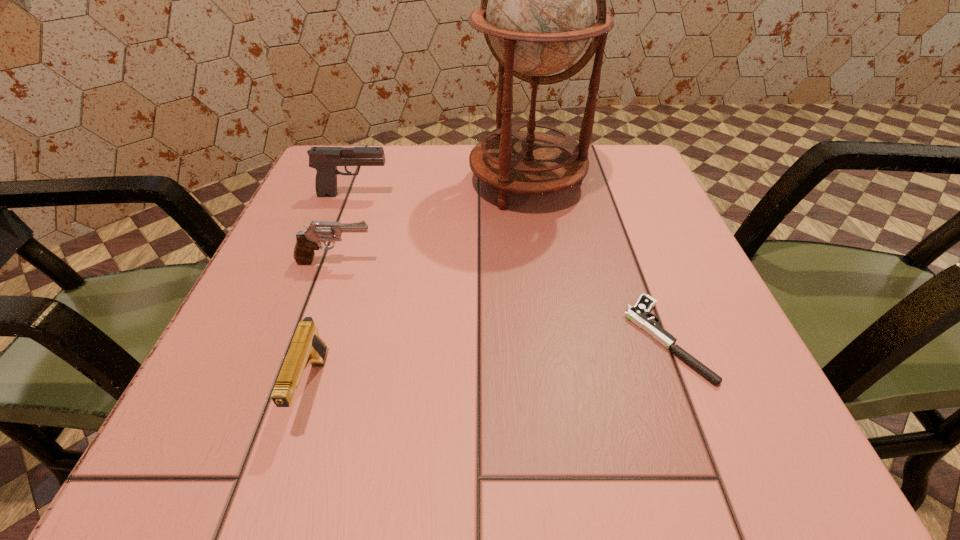
Locate an element on the screen. object that is the second nearest to the shortest pistol is located at coordinates click(x=307, y=241).

Image resolution: width=960 pixels, height=540 pixels. I want to click on pistol that stands as the closest to the rightmost pistol, so click(x=307, y=241).

At what (x,y) coordinates should I click in order to perform the action: click on pistol that stands as the second closest to the third farthest object. Please return your answer as a coordinate pair (x, y). Looking at the image, I should click on (325, 160).

Image resolution: width=960 pixels, height=540 pixels. In order to click on free space that satisfies the following two spatial constraints: 1. on the surface of the tallest object; 2. aim along the barrel of the tallest pistol in this screenshot , I will do `click(528, 194)`.

This screenshot has height=540, width=960. What are the coordinates of `free space that satisfies the following two spatial constraints: 1. on the surface of the tallest object; 2. aim along the barrel of the farthest pistol` in the screenshot? It's located at (528, 194).